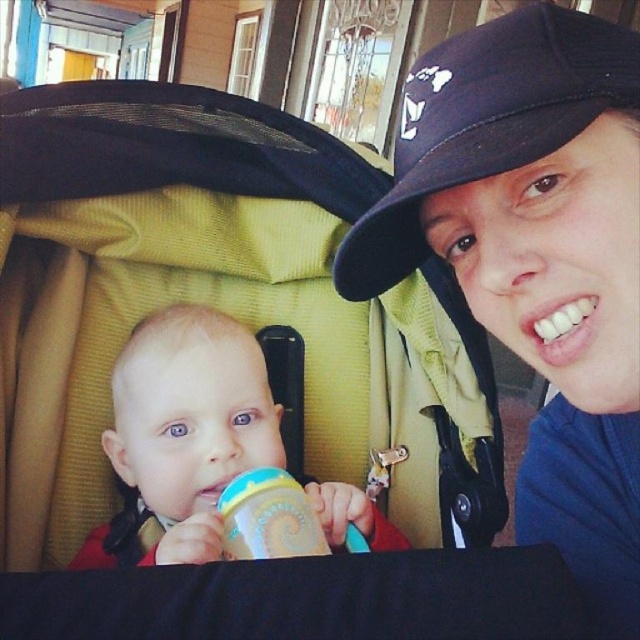
Please look at the image and tell me the exact coordinates of the navy blue fabric cap at upper right in the scene.

The navy blue fabric cap at upper right is located at coordinates (486, 122).

You are a photographer setting up for a portrait. You notice the blue fabric cap at upper center and the smooth plastic cup at center in the frame. Which object should you adjust to ensure both are in focus, considering their sizes and positions?

The blue fabric cap at upper center is much taller than the smooth plastic cup at center, so you should adjust the camera focus on the blue fabric cap at upper center to ensure both are in focus.